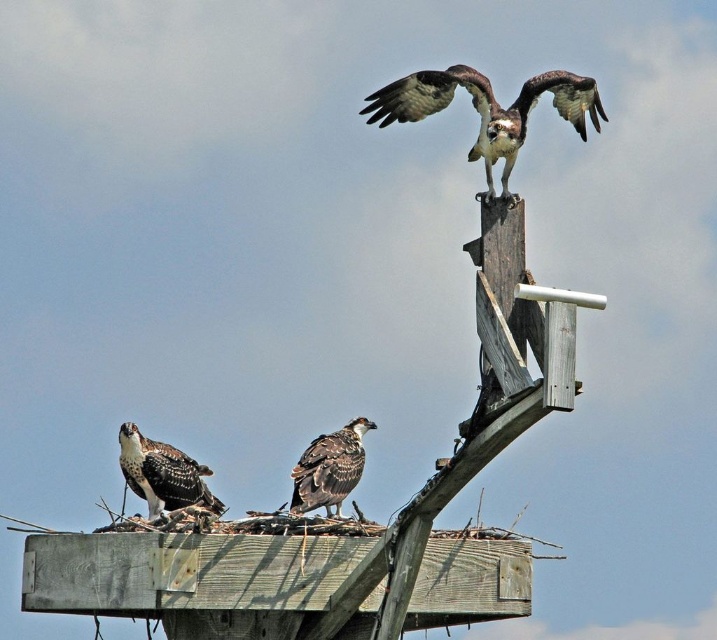
You are a birdwatcher observing the ospreys on the wooden structure. You notice two distinct feather groups, the brown speckled feathers at upper center and the dark brown feathers at center. Which of these two feather groups is positioned closer to you?

The brown speckled feathers at upper center are closer to the viewer than the dark brown feathers at center.

Based on the photo, you are a wildlife photographer aiming to capture a closeup of the brown speckled feathers at upper center located at point (488, 109). Given that your camera has a zoom range of 100 meters, can you confirm if you can focus on the brown speckled feathers at upper center from your current position?

The brown speckled feathers at upper center are located at point (488, 109), which is within the camera zoom range of 100 meters. Therefore, you can focus on the brown speckled feathers at upper center from your current position.

You are observing two ospreys on a wooden platform. The first has brown speckled feathers at lower left and the second has dark brown feathers at center. Which osprey is positioned more to the left?

The brown speckled feathers at lower left is more to the left than the dark brown feathers at center.